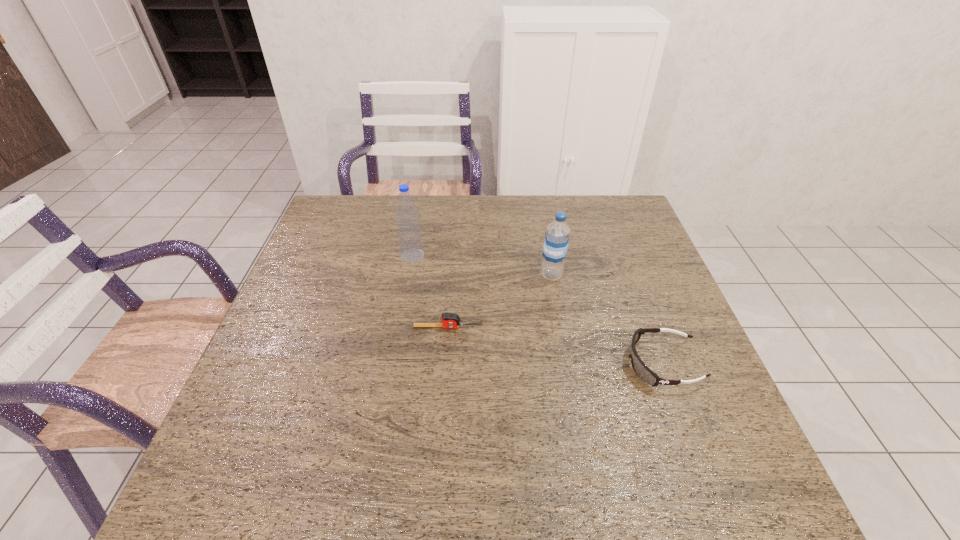
Find the location of a particular element. free space at the far left corner of the desktop is located at coordinates (330, 203).

Identify the location of vacant point located between the third object from right to left and the left water bottle. (430, 292).

Where is `empty space between the goggles and the farther water bottle`? empty space between the goggles and the farther water bottle is located at coordinates (538, 310).

This screenshot has height=540, width=960. What are the coordinates of `vacant space in between the rightmost object and the left water bottle` in the screenshot? It's located at (538, 310).

Locate an element on the screen. The height and width of the screenshot is (540, 960). free space between the tape measure and the nearest object is located at coordinates (555, 346).

In order to click on free space between the rightmost object and the farther water bottle in this screenshot , I will do tap(538, 310).

I want to click on free space between the left water bottle and the tape measure, so click(430, 292).

Where is `unoccupied position between the second nearest object and the farther water bottle`? The width and height of the screenshot is (960, 540). unoccupied position between the second nearest object and the farther water bottle is located at coordinates (430, 292).

Find the location of a particular element. unoccupied area between the farthest object and the nearer water bottle is located at coordinates (482, 266).

At what (x,y) coordinates should I click in order to perform the action: click on blank region between the third object from right to left and the left water bottle. Please return your answer as a coordinate pair (x, y). Looking at the image, I should click on (430, 292).